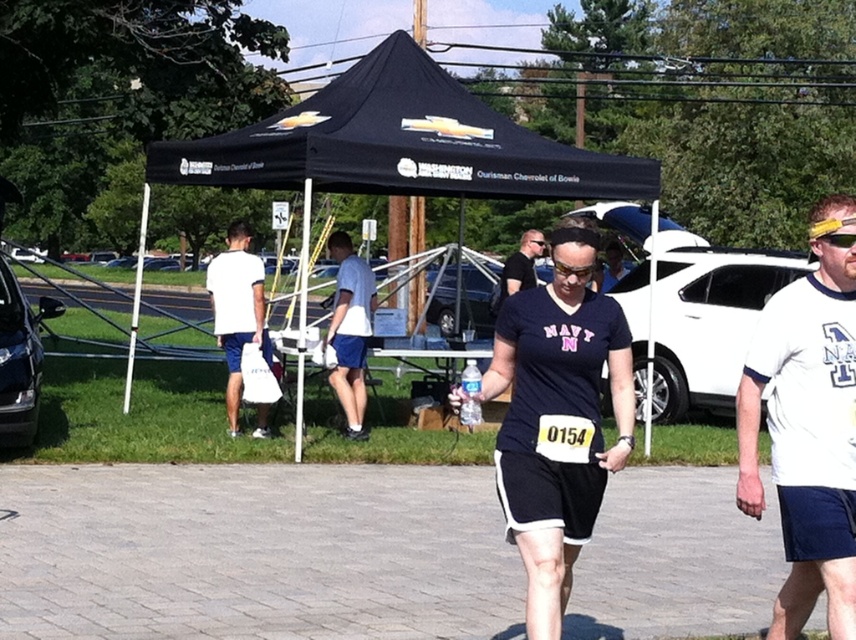
Question: Can you confirm if white plastic bag at center is thinner than white fabric bag at center?

Choices:
 (A) no
 (B) yes

Answer: (A)

Question: Is white matte bag at left wider than white fabric bag at center?

Choices:
 (A) yes
 (B) no

Answer: (A)

Question: Based on their relative distances, which object is nearer to the matte black t-shirt at center?

Choices:
 (A) black fabric canopy at center
 (B) white plastic bag at center

Answer: (A)

Question: Does white plastic bag at center have a lesser width compared to matte black t-shirt at center?

Choices:
 (A) yes
 (B) no

Answer: (A)

Question: Which point is farther from the camera taking this photo?

Choices:
 (A) (340, 323)
 (B) (535, 253)

Answer: (B)

Question: Which point is closer to the camera taking this photo?

Choices:
 (A) (250, 333)
 (B) (525, 285)

Answer: (A)